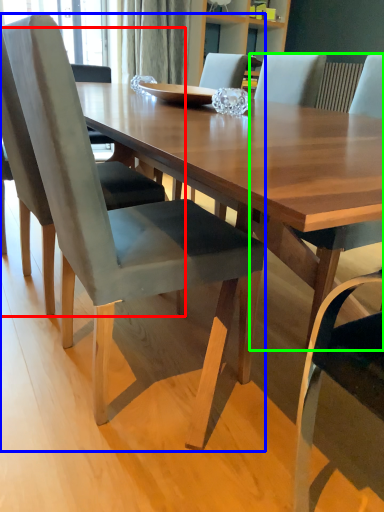
Question: Considering the real-world distances, which object is closest to chair (highlighted by a red box)? chair (highlighted by a blue box) or chair (highlighted by a green box).

Choices:
 (A) chair
 (B) chair

Answer: (A)